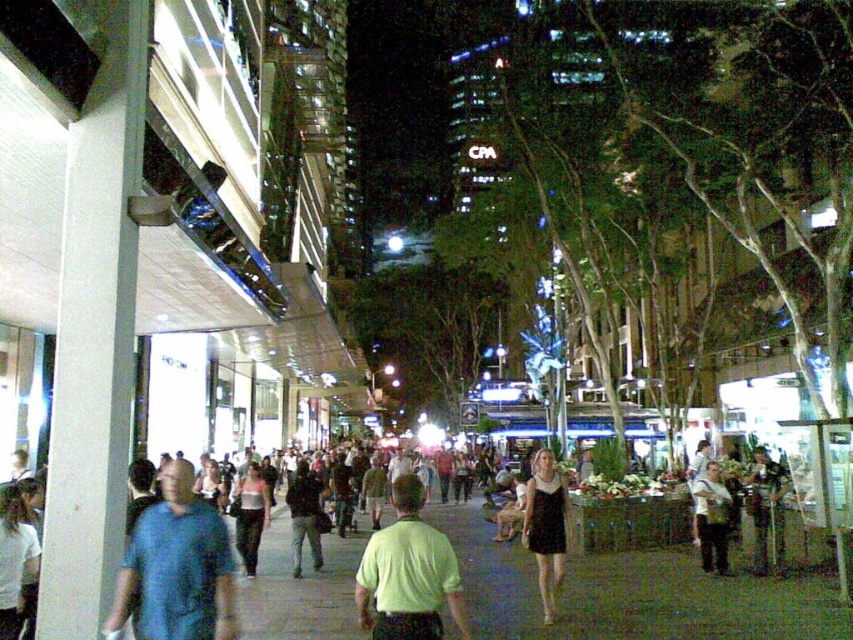
You are a fashion photographer who wants to take a photo of the black dress at center and the light brown leather jacket at lower right. Which one is closer to the camera?

The black dress at center is closer to the camera because it is in front of the light brown leather jacket at lower right.

You are a photographer trying to capture both the blue cotton shirt at center and the light pink fabric dress at center in a single frame. Given that your camera has a fixed focal length and you can only adjust your distance from the subjects, which subject should you move closer to in order to ensure both are in focus?

Since the blue cotton shirt at center is smaller than the light pink fabric dress at center, you should move closer to the blue cotton shirt at center. This adjustment will help ensure both subjects are within the camera focus range, as the smaller object requires being closer to maintain focus while the larger one can remain further back yet still in focus.

You are standing at the origin point of the coordinate system in this image. You want to find the blue cotton shirt at center. Which direction should you move to reach it?

The blue cotton shirt at center is located at coordinate point 0.887 on the x axis and 0.209 on the y axis. Since you are at the origin, you should move towards the positive x and positive y direction to reach it.